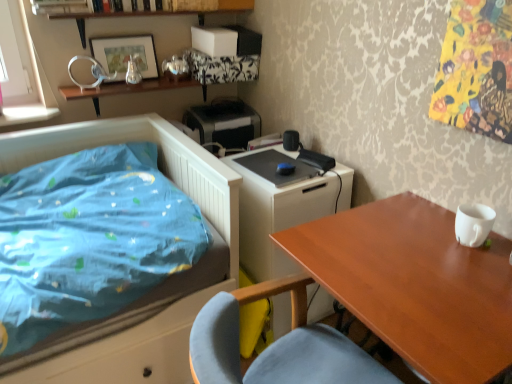
Where is `free space above wooden table at right (from a real-world perspective)`? The height and width of the screenshot is (384, 512). free space above wooden table at right (from a real-world perspective) is located at coordinates (426, 272).